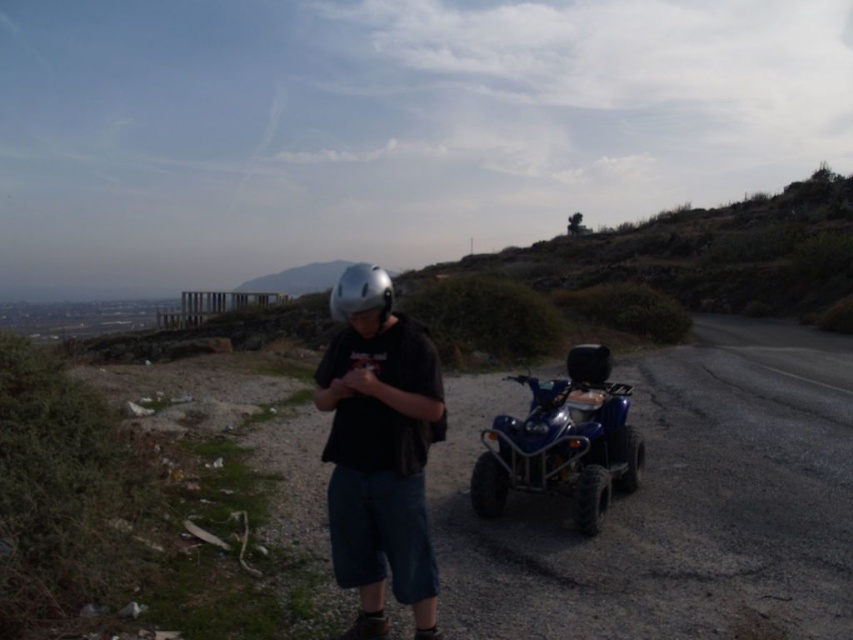
You are a photographer trying to capture both the matte black helmet at center and the silver metallic helmet at center in the same frame. Which helmet will appear closer to the camera in the photo?

The matte black helmet at center will appear closer to the camera in the photo because it is positioned in front of the silver metallic helmet at center.

You are a drone operator trying to locate the matte black helmet at center in an image. The coordinate system has the origin at the bottom left corner. The drone needs to hover directly above the helmet. What are the coordinates where the drone should hover?

The drone should hover at coordinates point (379, 451) where the matte black helmet at center is located.